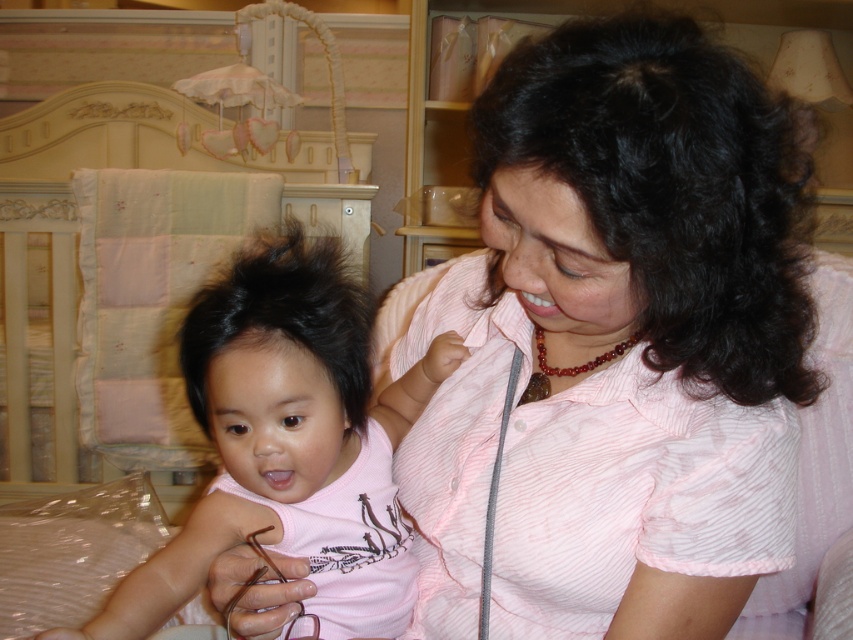
Question: In this image, where is pink striped shirt at center located relative to pink matte/touchy toddler at center?

Choices:
 (A) right
 (B) left

Answer: (A)

Question: Which object is farther from the camera taking this photo?

Choices:
 (A) pink matte/touchy toddler at center
 (B) pink striped shirt at center

Answer: (A)

Question: Among these points, which one is nearest to the camera?

Choices:
 (A) (289, 289)
 (B) (628, 481)

Answer: (A)

Question: Can you confirm if pink striped shirt at center is positioned to the right of pink matte/touchy toddler at center?

Choices:
 (A) no
 (B) yes

Answer: (B)

Question: Which point is farther to the camera?

Choices:
 (A) pink matte/touchy toddler at center
 (B) pink striped shirt at center

Answer: (A)

Question: Where is pink striped shirt at center located in relation to pink matte/touchy toddler at center in the image?

Choices:
 (A) below
 (B) above

Answer: (B)